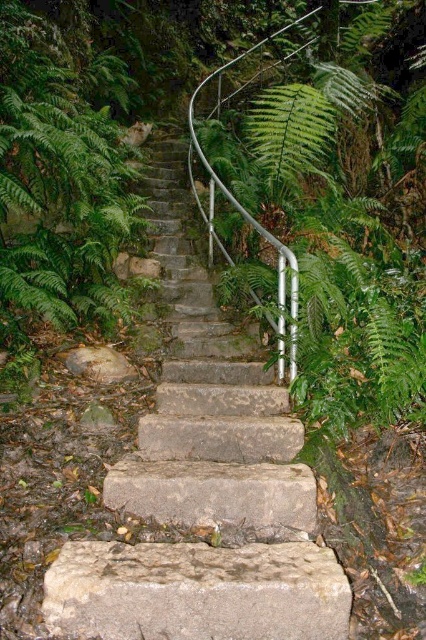
Question: Which object appears farthest from the camera in this image?

Choices:
 (A) green leafy fern at upper center
 (B) gray rough stone at center
 (C) stone stairs at center

Answer: (A)

Question: Is gray rough stone at center above green leafy fern at upper center?

Choices:
 (A) no
 (B) yes

Answer: (A)

Question: Which of these objects is positioned closest to the gray rough stone at center?

Choices:
 (A) stone stairs at center
 (B) green leafy fern at upper center

Answer: (A)

Question: Does gray rough stone at center lie behind green leafy fern at upper center?

Choices:
 (A) yes
 (B) no

Answer: (B)

Question: Among these objects, which one is farthest from the camera?

Choices:
 (A) green leafy fern at upper center
 (B) gray rough stone at center
 (C) stone stairs at center

Answer: (A)

Question: In this image, where is stone stairs at center located relative to green leafy fern at upper center?

Choices:
 (A) right
 (B) left

Answer: (B)